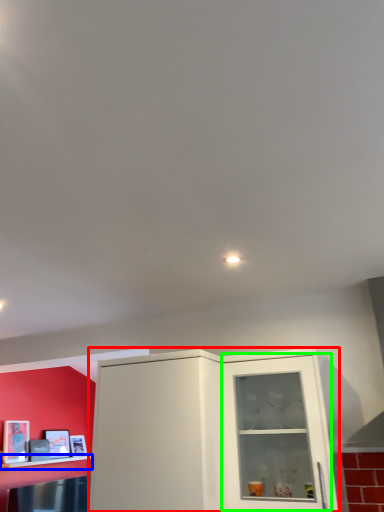
Question: Estimate the real-world distances between objects in this image. Which object is closer to cabinetry (highlighted by a red box), shelf (highlighted by a blue box) or glass door (highlighted by a green box)?

Choices:
 (A) shelf
 (B) glass door

Answer: (B)